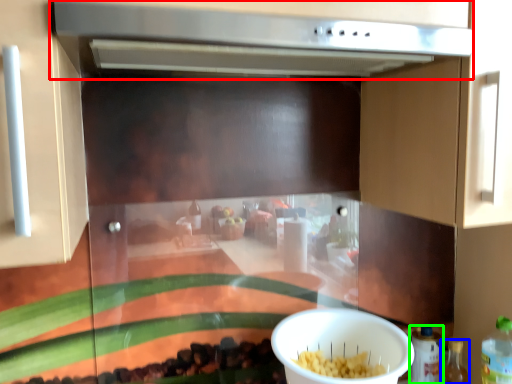
Question: Which object is positioned closest to vent (highlighted by a red box)? Select from bottle (highlighted by a blue box) and bottle (highlighted by a green box).

Choices:
 (A) bottle
 (B) bottle

Answer: (B)